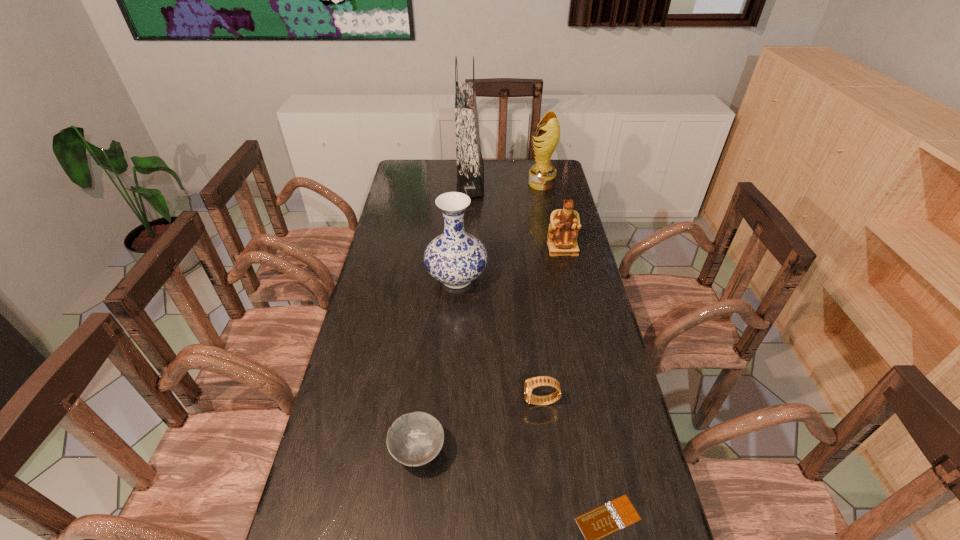
Identify the location of the tallest object. (470, 168).

Image resolution: width=960 pixels, height=540 pixels. Identify the location of award. (542, 175).

Where is `vase`? This screenshot has width=960, height=540. vase is located at coordinates (455, 258).

This screenshot has height=540, width=960. In order to click on figurine in this screenshot , I will do `click(564, 226)`.

You are a GUI agent. You are given a task and a screenshot of the screen. Output one action in this format:
    pyautogui.click(x=<x>, y=<y>)
    Task: Click on the fifth nearest object
    
    Given the screenshot: What is the action you would take?
    564,226

This screenshot has width=960, height=540. Identify the location of watch. [x=530, y=384].

Image resolution: width=960 pixels, height=540 pixels. In order to click on the fifth tallest object in this screenshot , I will do `click(530, 384)`.

This screenshot has width=960, height=540. I want to click on the sixth farthest object, so click(x=414, y=439).

I want to click on the sixth tallest object, so click(x=414, y=439).

You are a GUI agent. You are given a task and a screenshot of the screen. Output one action in this format:
    pyautogui.click(x=<x>, y=<y>)
    Task: Click on the vacant space situated 0.260m on the front of the shopping bag with the design
    The width and height of the screenshot is (960, 540).
    Given the screenshot: What is the action you would take?
    pyautogui.click(x=541, y=181)